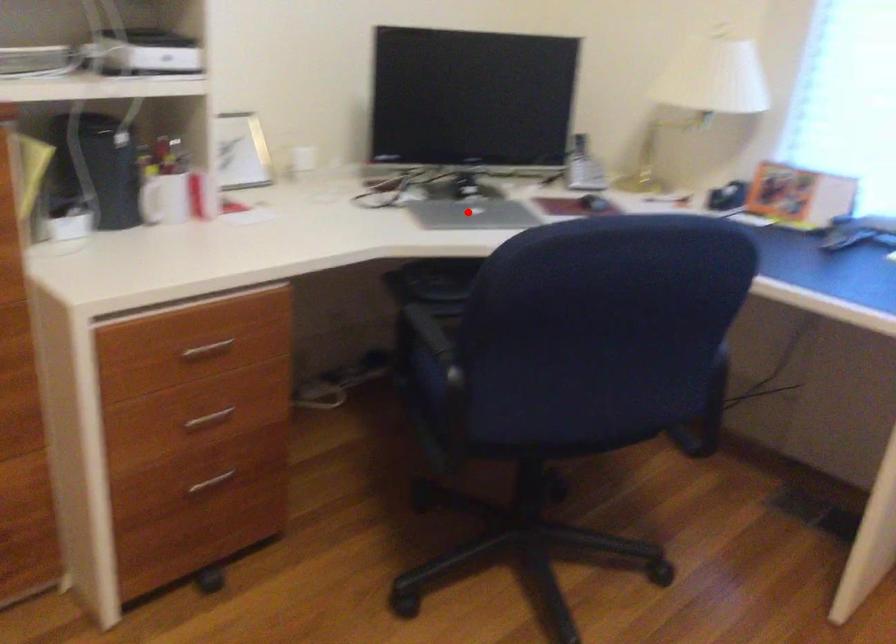
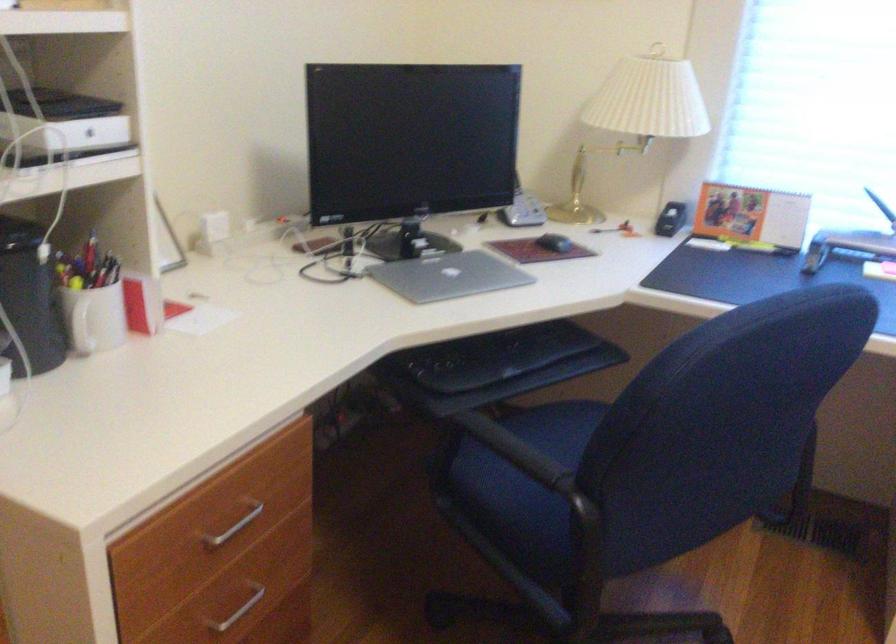
Locate, in the second image, the point that corresponds to the highlighted location in the first image.

(449, 276)